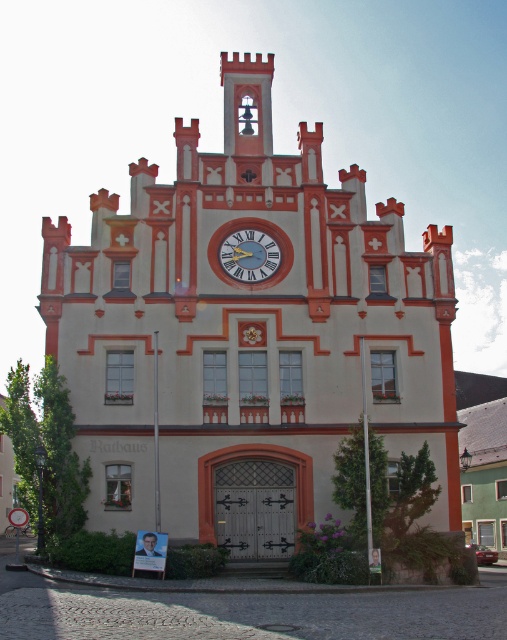
Which is below, white painted stone church at center or metallic clock face at center?

white painted stone church at center is below.

Can you confirm if white painted stone church at center is shorter than metallic clock face at center?

No, white painted stone church at center is not shorter than metallic clock face at center.

This screenshot has height=640, width=507. In order to click on white painted stone church at center in this screenshot , I will do coord(246,336).

Find the location of `white painted stone church at center`. white painted stone church at center is located at coordinates (246, 336).